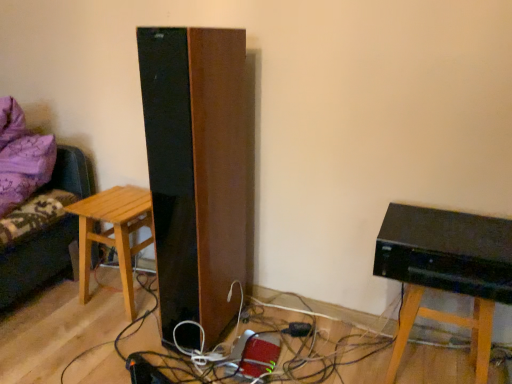
Question: Is light brown wooden stool at left completely or partially outside of purple fabric couch at left?

Choices:
 (A) no
 (B) yes

Answer: (B)

Question: Can you confirm if light brown wooden stool at left is positioned to the right of purple fabric couch at left?

Choices:
 (A) yes
 (B) no

Answer: (A)

Question: Considering the relative sizes of light brown wooden stool at left and purple fabric couch at left in the image provided, is light brown wooden stool at left bigger than purple fabric couch at left?

Choices:
 (A) yes
 (B) no

Answer: (B)

Question: Is light brown wooden stool at left next to purple fabric couch at left?

Choices:
 (A) no
 (B) yes

Answer: (A)

Question: Is light brown wooden stool at left oriented away from purple fabric couch at left?

Choices:
 (A) no
 (B) yes

Answer: (A)

Question: From the image's perspective, is light brown wooden stool at left on top of purple fabric couch at left?

Choices:
 (A) yes
 (B) no

Answer: (B)

Question: From a real-world perspective, is purple fabric couch at left located beneath light brown wooden stool at left?

Choices:
 (A) yes
 (B) no

Answer: (B)

Question: Would you consider purple fabric couch at left to be distant from light brown wooden stool at left?

Choices:
 (A) no
 (B) yes

Answer: (A)

Question: Does purple fabric couch at left have a lesser width compared to light brown wooden stool at left?

Choices:
 (A) yes
 (B) no

Answer: (B)

Question: Considering the relative sizes of purple fabric couch at left and light brown wooden stool at left in the image provided, is purple fabric couch at left wider than light brown wooden stool at left?

Choices:
 (A) yes
 (B) no

Answer: (A)

Question: Could you tell me if purple fabric couch at left is facing light brown wooden stool at left?

Choices:
 (A) yes
 (B) no

Answer: (B)

Question: Is the depth of purple fabric couch at left greater than that of light brown wooden stool at left?

Choices:
 (A) yes
 (B) no

Answer: (B)

Question: From the image's perspective, is black glossy computer at lower right above purple fabric couch at left?

Choices:
 (A) no
 (B) yes

Answer: (A)